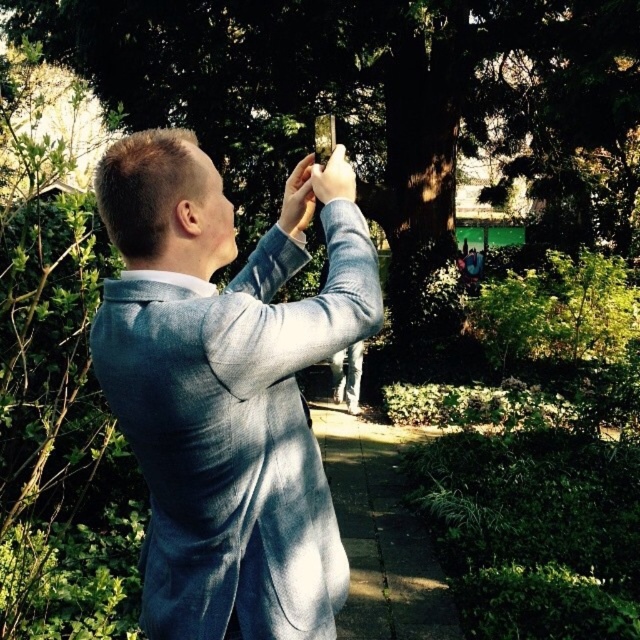
Question: Is concrete sidewalk at center below matte gray phone at center?

Choices:
 (A) yes
 (B) no

Answer: (A)

Question: Which object is positioned farthest from the concrete sidewalk at center?

Choices:
 (A) matte gray phone at center
 (B) light blue textured blazer at center

Answer: (A)

Question: Considering the real-world distances, which object is farthest from the light blue textured blazer at center?

Choices:
 (A) matte blue hand at upper center
 (B) concrete sidewalk at center
 (C) matte gray phone at center

Answer: (B)

Question: Is light blue textured blazer at center to the left of concrete sidewalk at center from the viewer's perspective?

Choices:
 (A) yes
 (B) no

Answer: (A)

Question: From the image, what is the correct spatial relationship of light blue textured blazer at center in relation to matte gray phone at center?

Choices:
 (A) below
 (B) above

Answer: (A)

Question: Which object is positioned farthest from the light blue textured blazer at center?

Choices:
 (A) concrete sidewalk at center
 (B) matte gray phone at center

Answer: (A)